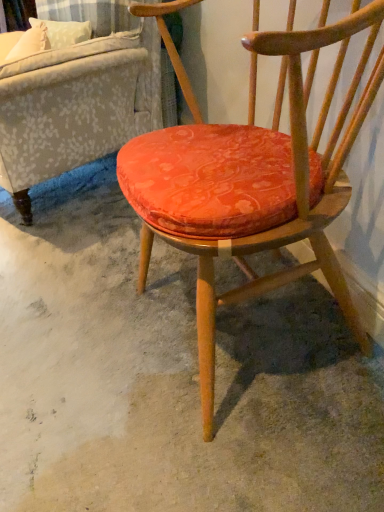
Question: Does textured gray fabric couch at upper left have a smaller size compared to orange fabric cushion at center?

Choices:
 (A) yes
 (B) no

Answer: (B)

Question: Could you tell me if textured gray fabric couch at upper left is facing orange fabric cushion at center?

Choices:
 (A) no
 (B) yes

Answer: (A)

Question: Can you confirm if textured gray fabric couch at upper left is shorter than orange fabric cushion at center?

Choices:
 (A) yes
 (B) no

Answer: (B)

Question: From a real-world perspective, does textured gray fabric couch at upper left sit lower than orange fabric cushion at center?

Choices:
 (A) no
 (B) yes

Answer: (A)

Question: Does textured gray fabric couch at upper left have a lesser width compared to orange fabric cushion at center?

Choices:
 (A) no
 (B) yes

Answer: (A)

Question: Is textured gray fabric couch at upper left positioned in front of orange fabric cushion at center?

Choices:
 (A) yes
 (B) no

Answer: (B)

Question: Does orange fabric cushion at center come in front of textured gray fabric couch at upper left?

Choices:
 (A) no
 (B) yes

Answer: (B)

Question: Are orange fabric cushion at center and textured gray fabric couch at upper left located far from each other?

Choices:
 (A) yes
 (B) no

Answer: (B)

Question: Can you confirm if orange fabric cushion at center is thinner than textured gray fabric couch at upper left?

Choices:
 (A) no
 (B) yes

Answer: (B)

Question: From the image's perspective, is orange fabric cushion at center located beneath textured gray fabric couch at upper left?

Choices:
 (A) yes
 (B) no

Answer: (A)

Question: Does orange fabric cushion at center have a greater width compared to textured gray fabric couch at upper left?

Choices:
 (A) yes
 (B) no

Answer: (B)

Question: Is orange fabric cushion at center at the right side of textured gray fabric couch at upper left?

Choices:
 (A) no
 (B) yes

Answer: (B)

Question: Is velvet orange cushion at center oriented away from textured gray fabric couch at upper left?

Choices:
 (A) yes
 (B) no

Answer: (B)